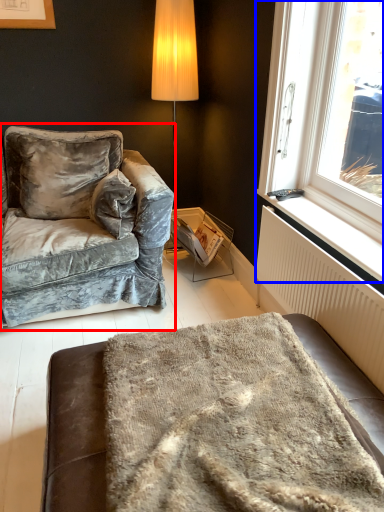
Question: Among these objects, which one is nearest to the camera, studio couch (highlighted by a red box) or window (highlighted by a blue box)?

Choices:
 (A) studio couch
 (B) window

Answer: (B)